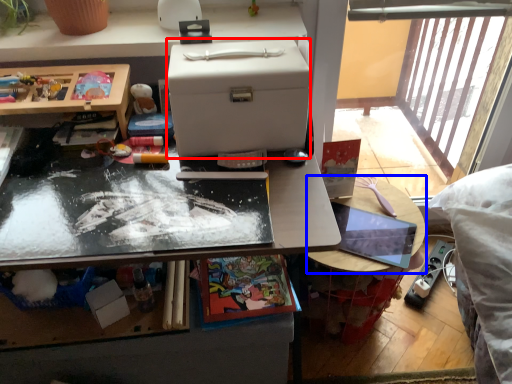
Question: Which object appears farthest to the camera in this image, box (highlighted by a red box) or table (highlighted by a blue box)?

Choices:
 (A) box
 (B) table

Answer: (B)